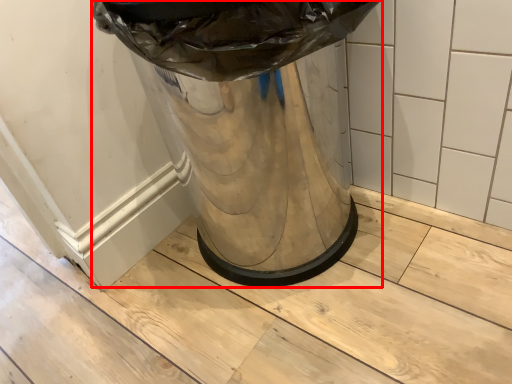
Question: Considering the relative positions of waste container (annotated by the red box) and tile in the image provided, where is waste container (annotated by the red box) located with respect to the staircase?

Choices:
 (A) right
 (B) left

Answer: (B)